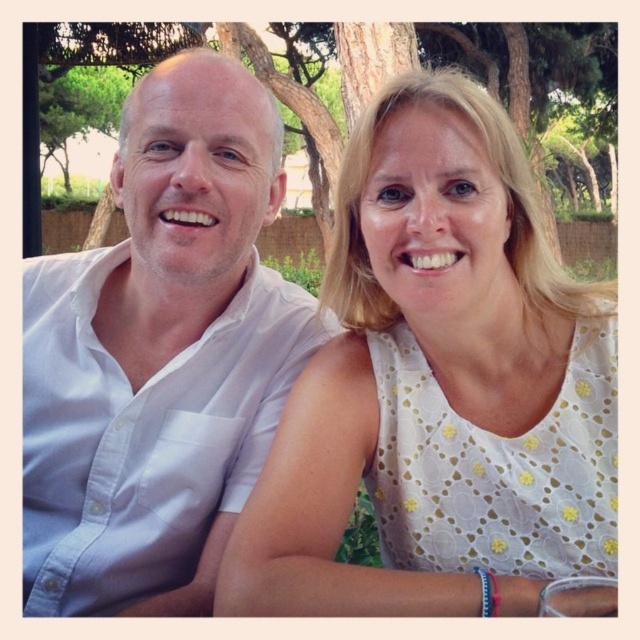
Question: Which of the following is the closest to the observer?

Choices:
 (A) white cotton shirt at left
 (B) white dotted dress at center

Answer: (B)

Question: From the image, what is the correct spatial relationship of white dotted dress at center in relation to white cotton shirt at left?

Choices:
 (A) left
 (B) right

Answer: (B)

Question: Does white cotton shirt at left have a greater width compared to green leafy tree at upper center?

Choices:
 (A) no
 (B) yes

Answer: (A)

Question: Is white dotted dress at center wider than green leafy tree at upper center?

Choices:
 (A) no
 (B) yes

Answer: (A)

Question: Considering the real-world distances, which object is closest to the green leafy tree at upper center?

Choices:
 (A) white dotted dress at center
 (B) white cotton shirt at left

Answer: (B)

Question: Among these objects, which one is nearest to the camera?

Choices:
 (A) white dotted dress at center
 (B) green leafy tree at upper center

Answer: (A)